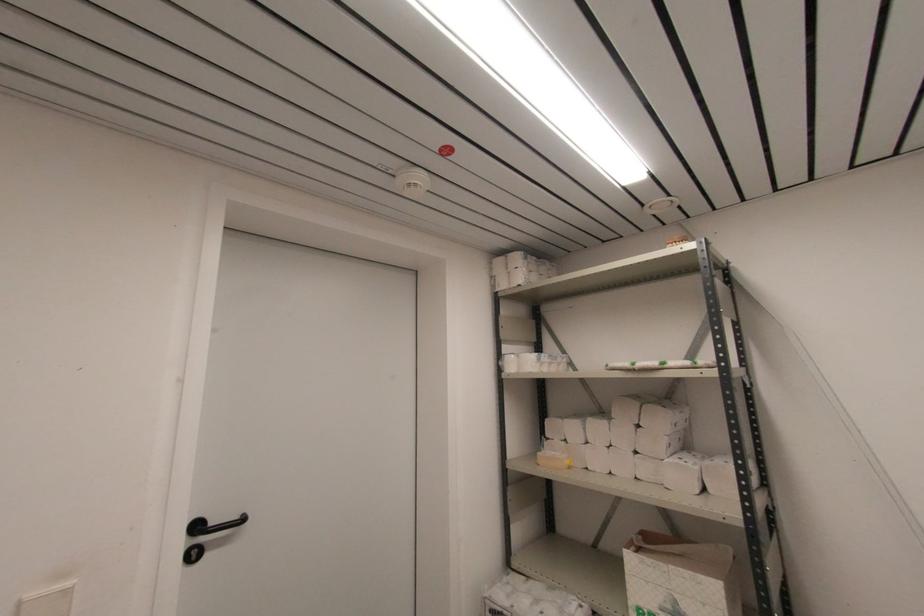
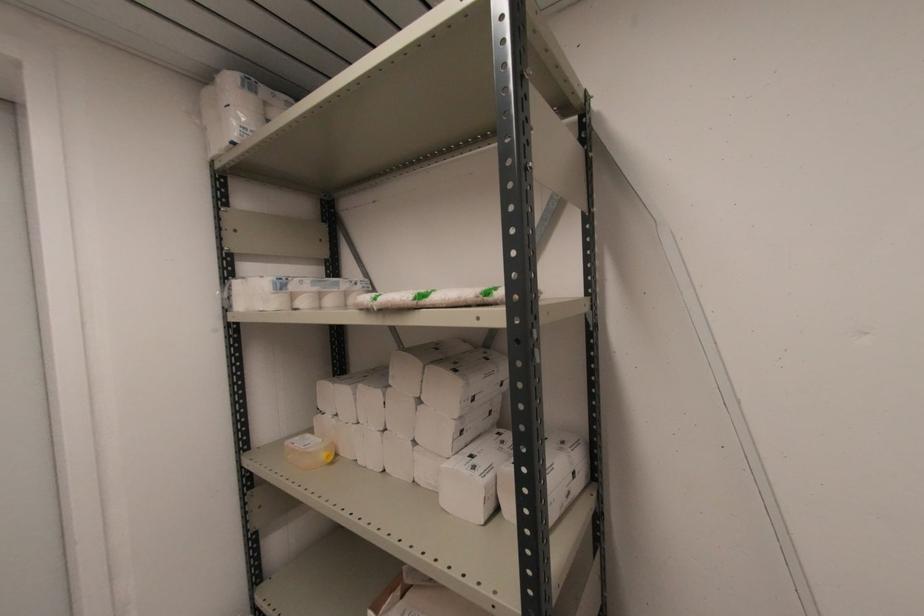
In the second image, find the point that corresponds to (540,454) in the first image.

(289, 442)